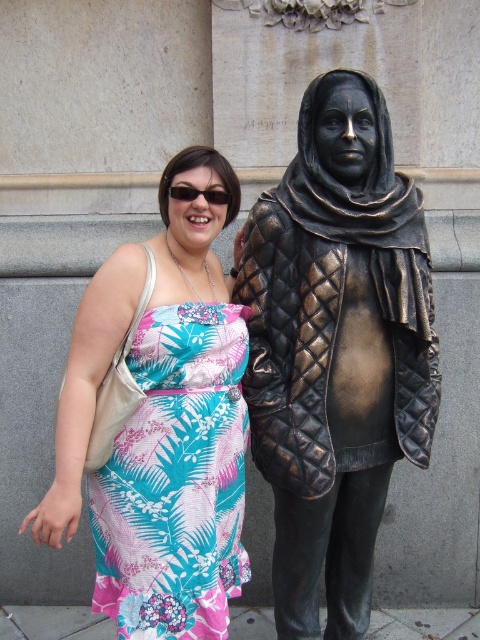
You are a photographer trying to capture the statue of the person in a quilted jacket and headscarf. The statue is located at point (336,349). You want to position the woman in the tropical dress so that she appears to be interacting with the statue. Where should you place her relative to the statue?

The bronze quilted jacket at right is located at point (336,349). To have the woman interact with the statue, position her near the statue at that coordinate.

From the picture: You are a photographer trying to capture a photo where the bronze quilted jacket at right and the floral print fabric dress at center are both in focus. Based on their positions, which object should you focus on first to ensure both are sharp?

The bronze quilted jacket at right is located above the floral print fabric dress at center. To ensure both are in focus, you should focus on the bronze quilted jacket at right first since it is farther away and adjusting focus from there will help capture both subjects more effectively.